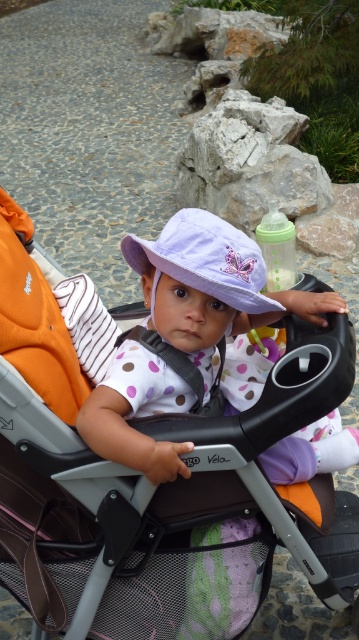
Who is lower down, orange fabric stroller at center or matte white hat at center?

orange fabric stroller at center is below.

Is point (72, 465) in front of point (222, 321)?

That is True.

You are a GUI agent. You are given a task and a screenshot of the screen. Output one action in this format:
    pyautogui.click(x=<x>, y=<y>)
    Task: Click on the orange fabric stroller at center
    The image size is (359, 640).
    Given the screenshot: What is the action you would take?
    pyautogui.click(x=152, y=486)

Can you confirm if matte white hat at center is shorter than lavender fabric hat at center?

No.

What are the coordinates of `matte white hat at center` in the screenshot? It's located at (211, 285).

In the scene shown: Who is more forward, (255, 576) or (156, 280)?

Point (156, 280) is in front.

Is orange fabric stroller at center taller than lavender fabric hat at center?

Yes.

Between point (126, 508) and point (245, 257), which one is positioned behind?

Point (245, 257)

Locate an element on the screen. The width and height of the screenshot is (359, 640). orange fabric stroller at center is located at coordinates (152, 486).